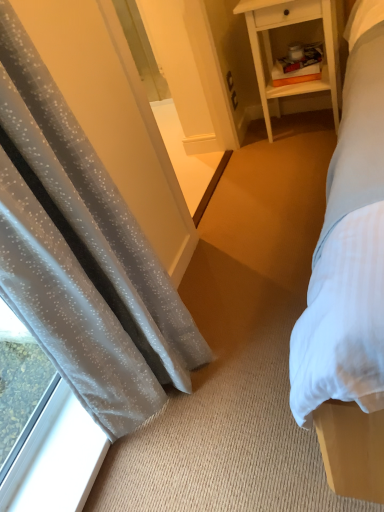
Question: Does transparent glass window at lower left have a lesser height compared to translucent gray curtain at left?

Choices:
 (A) yes
 (B) no

Answer: (A)

Question: Is there a large distance between transparent glass window at lower left and translucent gray curtain at left?

Choices:
 (A) no
 (B) yes

Answer: (A)

Question: Considering the relative sizes of transparent glass window at lower left and translucent gray curtain at left in the image provided, is transparent glass window at lower left bigger than translucent gray curtain at left?

Choices:
 (A) no
 (B) yes

Answer: (A)

Question: Could you tell me if transparent glass window at lower left is turned towards translucent gray curtain at left?

Choices:
 (A) no
 (B) yes

Answer: (A)

Question: Does transparent glass window at lower left have a lesser width compared to translucent gray curtain at left?

Choices:
 (A) yes
 (B) no

Answer: (A)

Question: Is transparent glass window at lower left taller or shorter than white wood nightstand at upper right?

Choices:
 (A) short
 (B) tall

Answer: (A)

Question: Looking at their shapes, would you say transparent glass window at lower left is wider or thinner than white wood nightstand at upper right?

Choices:
 (A) thin
 (B) wide

Answer: (A)

Question: Considering their positions, is transparent glass window at lower left located in front of or behind white wood nightstand at upper right?

Choices:
 (A) behind
 (B) front

Answer: (B)

Question: Is transparent glass window at lower left inside the boundaries of white wood nightstand at upper right, or outside?

Choices:
 (A) outside
 (B) inside

Answer: (A)

Question: Visually, is translucent gray curtain at left positioned to the left or to the right of white wood nightstand at upper right?

Choices:
 (A) left
 (B) right

Answer: (A)

Question: Based on their sizes in the image, would you say translucent gray curtain at left is bigger or smaller than white wood nightstand at upper right?

Choices:
 (A) big
 (B) small

Answer: (A)

Question: Considering the positions of point (96, 280) and point (327, 59), is point (96, 280) closer or farther from the camera than point (327, 59)?

Choices:
 (A) farther
 (B) closer

Answer: (B)

Question: From the image's perspective, relative to white wood nightstand at upper right, is translucent gray curtain at left above or below?

Choices:
 (A) below
 (B) above

Answer: (A)

Question: From their relative heights in the image, would you say white wood nightstand at upper right is taller or shorter than translucent gray curtain at left?

Choices:
 (A) tall
 (B) short

Answer: (B)

Question: From the image's perspective, is white wood nightstand at upper right located above or below translucent gray curtain at left?

Choices:
 (A) below
 (B) above

Answer: (B)